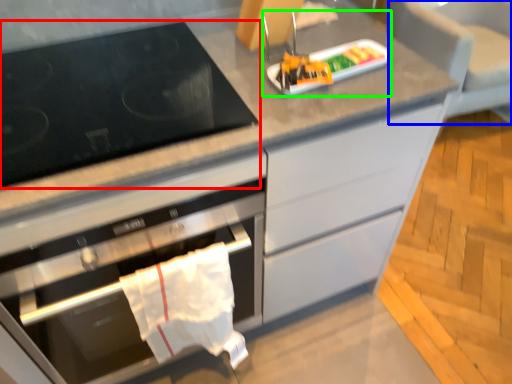
Question: Which object is the farthest from gas stove (highlighted by a red box)? Choose among these: armchair (highlighted by a blue box) or appliance (highlighted by a green box).

Choices:
 (A) armchair
 (B) appliance

Answer: (A)